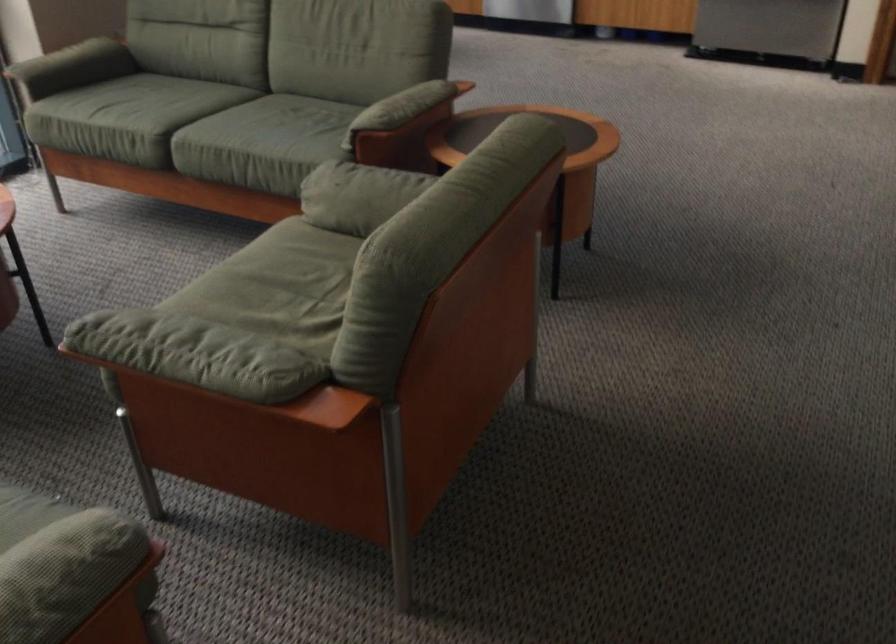
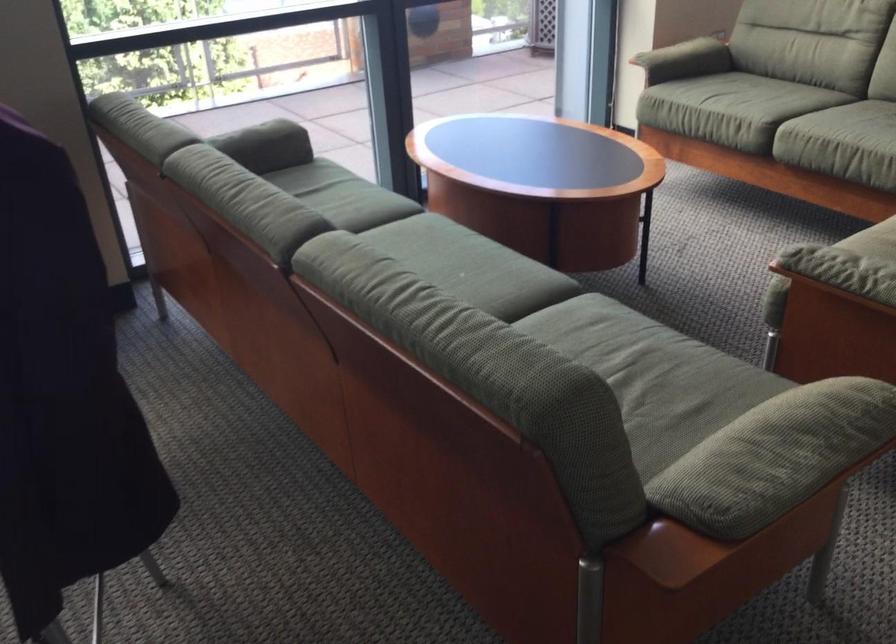
Locate, in the second image, the point that corresponds to [141,131] in the first image.

(751, 111)